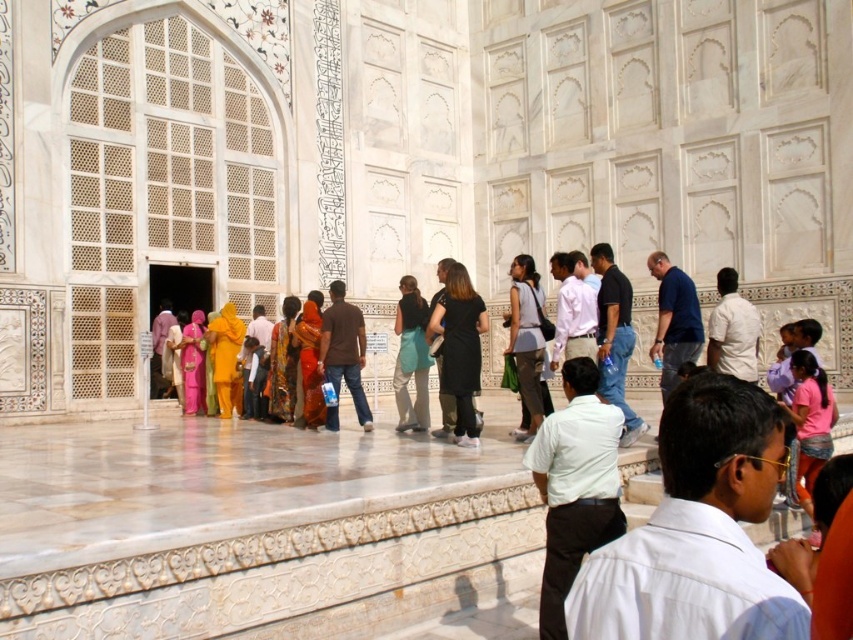
Is matte gray pants at center shorter than printed silk sari at center?

No.

Between point (520, 298) and point (283, 412), which one is positioned in front?

Point (520, 298) is more forward.

The height and width of the screenshot is (640, 853). I want to click on matte gray pants at center, so click(526, 340).

Is point (526, 404) less distant than point (393, 321)?

Yes, point (526, 404) is closer to viewer.

Is matte gray pants at center to the right of matte teal dress at center from the viewer's perspective?

Yes, matte gray pants at center is to the right of matte teal dress at center.

The image size is (853, 640). Describe the element at coordinates (526, 340) in the screenshot. I see `matte gray pants at center` at that location.

Where is `matte gray pants at center`? matte gray pants at center is located at coordinates (526, 340).

Is black matte dress at center closer to the viewer compared to matte gray pants at center?

Yes.

Does point (456, 308) lie behind point (532, 406)?

No, (456, 308) is closer to viewer.

Between point (440, 301) and point (540, 310), which one is positioned in front?

Positioned in front is point (440, 301).

Locate an element on the screen. black matte dress at center is located at coordinates (459, 348).